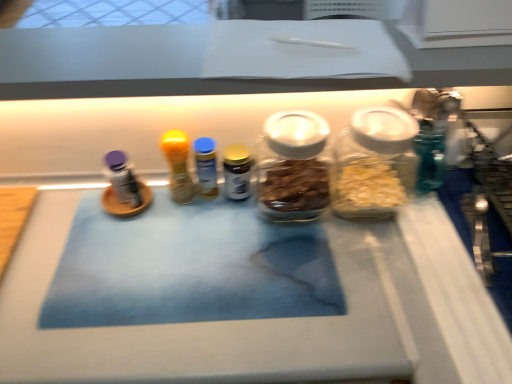
The image size is (512, 384). In order to click on unoccupied area in front of gold metallic spice jar at center, which is counted as the third bottle, starting from the right in this screenshot , I will do `click(233, 265)`.